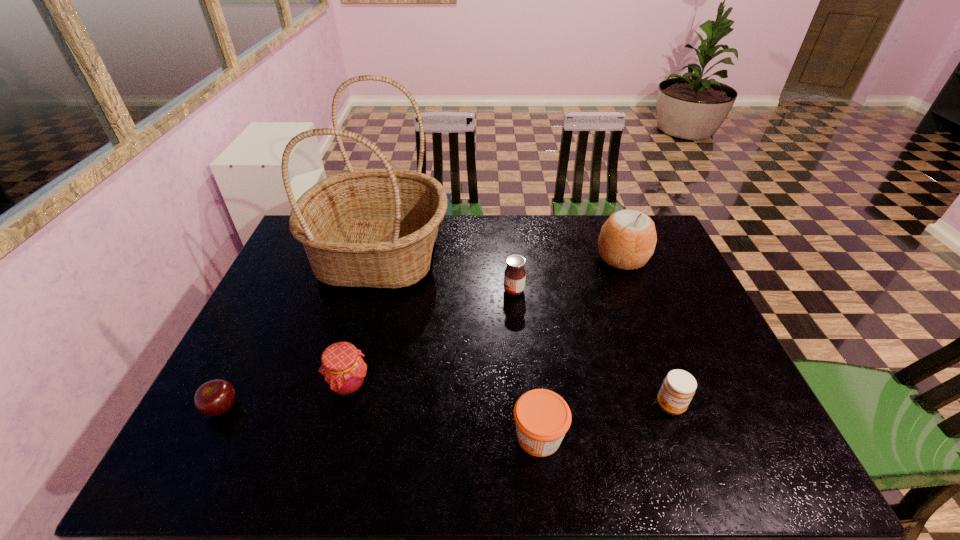
Image resolution: width=960 pixels, height=540 pixels. What are the coordinates of `basket` in the screenshot? It's located at (376, 228).

This screenshot has width=960, height=540. I want to click on coconut, so click(x=627, y=240).

Where is `the farthest jam`? This screenshot has height=540, width=960. the farthest jam is located at coordinates (515, 274).

Where is `the leftmost jam`? This screenshot has width=960, height=540. the leftmost jam is located at coordinates (344, 371).

Locate an element on the screen. the rightmost jam is located at coordinates (678, 388).

Find the location of a particular element. Image resolution: width=960 pixels, height=540 pixels. apple is located at coordinates (x=214, y=398).

Locate an element on the screen. The image size is (960, 540). vacant space situated 0.340m on the front of the basket is located at coordinates (338, 407).

Where is `vacant space located on the front of the sixth shortest object`? Image resolution: width=960 pixels, height=540 pixels. vacant space located on the front of the sixth shortest object is located at coordinates (664, 367).

This screenshot has width=960, height=540. In order to click on free spot located 0.300m on the label side of the farthest jam in this screenshot , I will do `click(403, 291)`.

Locate an element on the screen. This screenshot has height=540, width=960. vacant space located on the label side of the farthest jam is located at coordinates (386, 291).